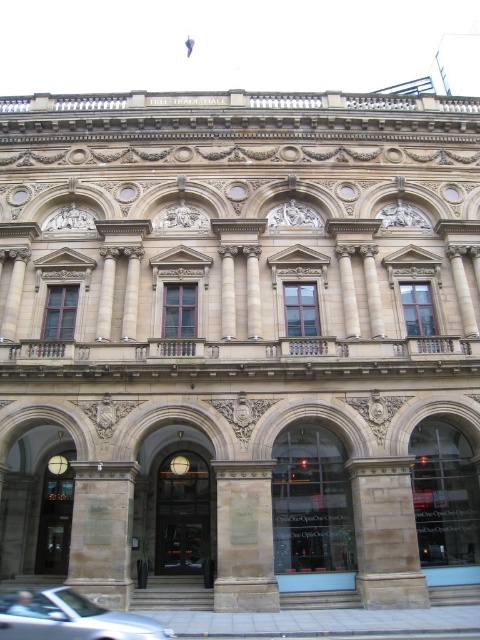
Which is more to the left, brown stone pillar at center or brown stone pillar at lower left?

From the viewer's perspective, brown stone pillar at lower left appears more on the left side.

The image size is (480, 640). What do you see at coordinates (385, 532) in the screenshot?
I see `brown stone pillar at center` at bounding box center [385, 532].

The width and height of the screenshot is (480, 640). I want to click on brown stone pillar at center, so click(385, 532).

Who is taller, brown stone pillar at center or stone textured column at center?

With more height is brown stone pillar at center.

Who is positioned more to the right, brown stone pillar at center or stone textured column at center?

brown stone pillar at center is more to the right.

Locate an element on the screen. brown stone pillar at center is located at coordinates (385, 532).

Looking at this image, is brown stone pillar at center thinner than silver metallic car at lower left?

Correct, brown stone pillar at center's width is less than silver metallic car at lower left's.

Between brown stone pillar at center and silver metallic car at lower left, which one has less height?

silver metallic car at lower left is shorter.

Is point (396, 588) more distant than point (115, 636)?

Yes, point (396, 588) is farther from viewer.

This screenshot has height=640, width=480. Identify the location of brown stone pillar at center. (385, 532).